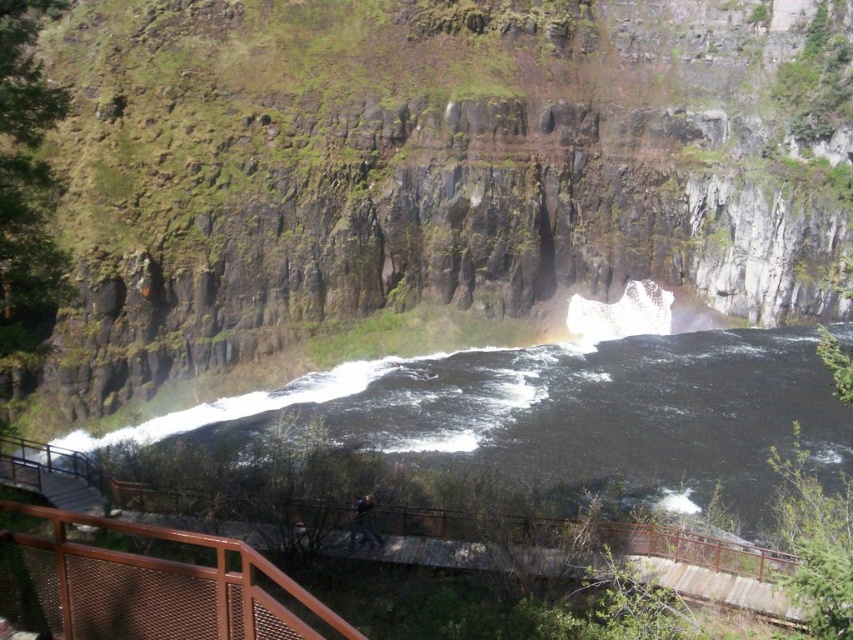
In the scene shown: You are standing at the point labeled point (492, 170) and want to take a photo of the waterfall. If you move 10 meters closer to the waterfall, will you be able to capture the entire waterfall in your camera frame?

The point labeled point (492, 170) is 81.83 meters away from the viewer. Moving 10 meters closer would place you at 71.83 meters away. However, without knowing the camera frame size or angle, it is impossible to determine if the entire waterfall will fit. The question cannot be answered with the given information.

You are standing on the wooden walkway and want to take a photo of both the green mossy rock at upper center and the black water at center. Which object should you frame first in your camera to ensure both are in the shot?

The green mossy rock at upper center is positioned on the left side of black water at center, so you should frame the green mossy rock at upper center first on the left to include both in the shot.